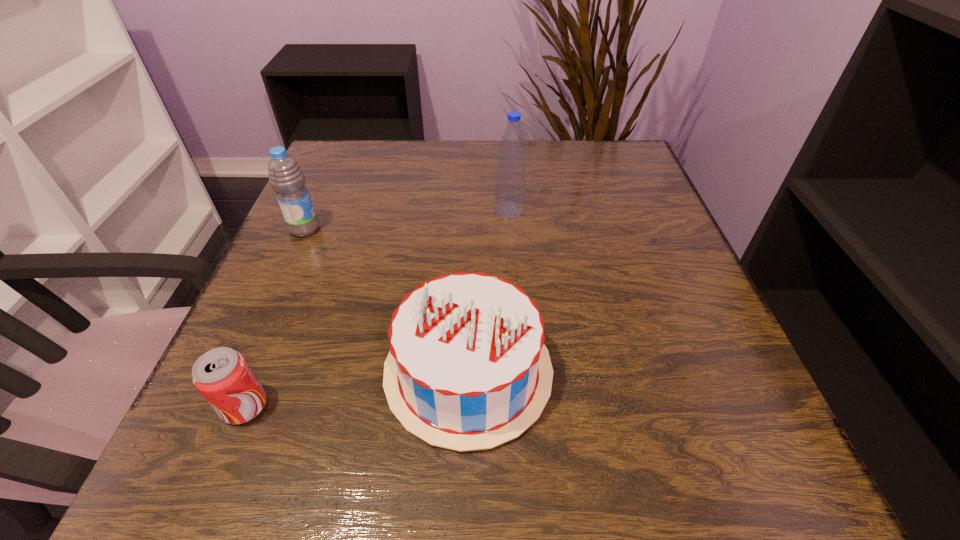
You are a GUI agent. You are given a task and a screenshot of the screen. Output one action in this format:
    pyautogui.click(x=<x>, y=<y>)
    Task: Click on the free space between the soda can and the right water bottle
    This screenshot has height=540, width=960.
    Given the screenshot: What is the action you would take?
    pyautogui.click(x=377, y=308)

This screenshot has height=540, width=960. Find the location of `the third closest object relative to the soda can`. the third closest object relative to the soda can is located at coordinates (510, 182).

This screenshot has width=960, height=540. I want to click on object that is the closest one to the third shortest object, so click(x=467, y=369).

Locate an element on the screen. The width and height of the screenshot is (960, 540). vacant space that satisfies the following two spatial constraints: 1. on the back side of the soda can; 2. on the left side of the tallest object is located at coordinates (325, 210).